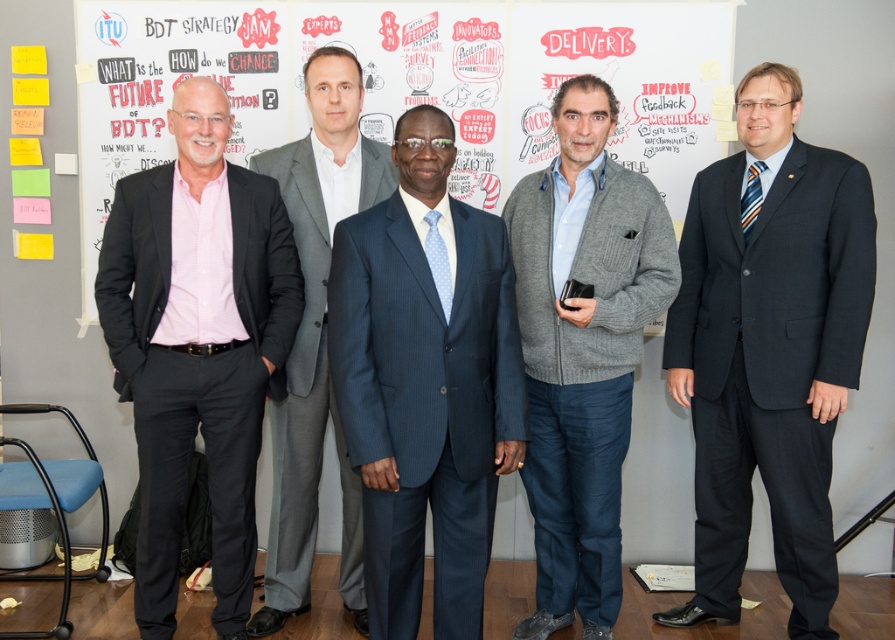
Question: Which point is farther from the camera taking this photo?

Choices:
 (A) (314, 20)
 (B) (303, 548)
 (C) (669, 252)
 (D) (828, 237)

Answer: (A)

Question: Is dark gray suit at right smaller than gray suit at center?

Choices:
 (A) no
 (B) yes

Answer: (B)

Question: Which is nearer to the matte black suit at left?

Choices:
 (A) blue pinstripe suit at center
 (B) white paperboard at center

Answer: (A)

Question: Which point appears closest to the camera in this image?

Choices:
 (A) (185, 317)
 (B) (465, 308)
 (C) (840, 241)

Answer: (B)

Question: From the image, what is the correct spatial relationship of dark gray suit at right in relation to gray knitted cardigan at center?

Choices:
 (A) above
 (B) below

Answer: (A)

Question: Can you confirm if blue pinstripe suit at center is positioned to the right of gray knitted cardigan at center?

Choices:
 (A) yes
 (B) no

Answer: (B)